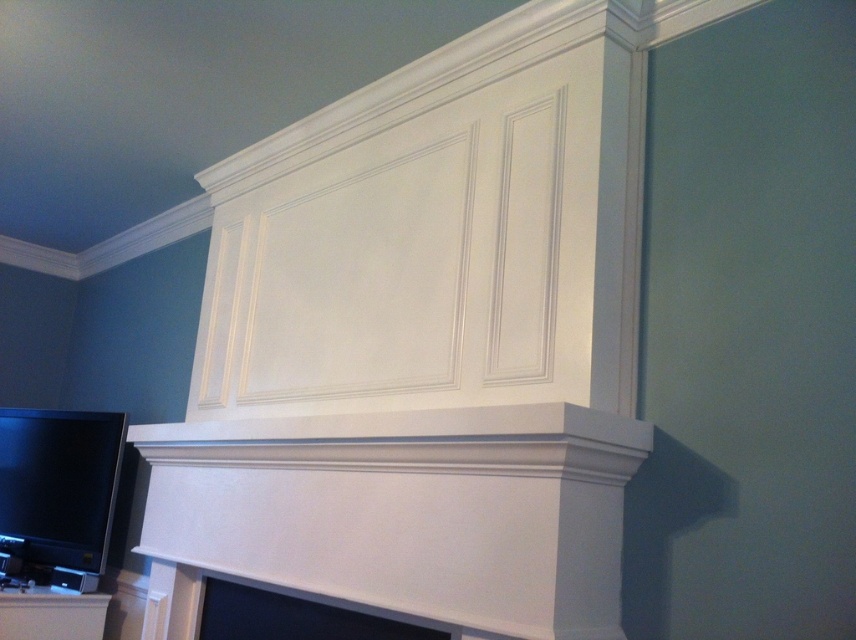
You are arranging a new painting to hang between the matte black flat screen tv at lower left and the matte white fireplace at lower center. Which object should the painting be placed in front of to ensure it is visible from the main seating area?

The painting should be placed in front of the matte white fireplace at lower center because it is behind the matte black flat screen tv at lower left, so placing it in front of the fireplace would make it visible from the main seating area.

You are planning to place a new decorative item on the mantel. The item is 2 feet wide. The mantel is between the matte black flat screen tv at lower left and the matte white fireplace at lower center. Can the item fit on the mantel if it needs to be centered between them?

The matte black flat screen tv at lower left has a lesser width compared to the matte white fireplace at lower center. Therefore, the distance between them is greater than twice the width of the TV. Since the decorative item is only 2 feet wide, it can fit between them as long as the total space between the TV and the fireplace is at least 2 feet. However, the exact fit depends on the actual distance, but based on the given information, the item should fit since the fireplace is wider, creating more space.

You are standing in the room and want to locate the matte black flat screen tv at lower left. According to the coordinates given, where exactly should you look?

The matte black flat screen tv at lower left is located at point (58,484).